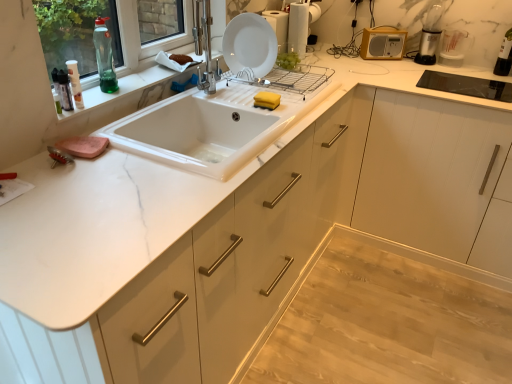
Measure the distance between point (190, 291) and camera.

The distance of point (190, 291) from camera is 1.14 meters.

In the scene shown: Measure the distance between white glossy drawer at center and camera.

The distance of white glossy drawer at center from camera is 33.10 inches.

The image size is (512, 384). Identify the location of light wood floor at lower right. (389, 320).

Describe the element at coordinates (104, 56) in the screenshot. The height and width of the screenshot is (384, 512). I see `green glass bottle at upper left, which is counted as the 2th bottle, starting from the back` at that location.

This screenshot has width=512, height=384. Identify the location of white marble sink at center. (196, 134).

What are the coordinates of `white glossy drawer at center` in the screenshot? It's located at (238, 259).

Considering the points (373, 304) and (367, 49), which point is behind, point (373, 304) or point (367, 49)?

Point (367, 49)

Which of these two, light wood floor at lower right or yellow matte radio at upper right, which is the second appliance in right-to-left order, is smaller?

With smaller size is yellow matte radio at upper right, which is the second appliance in right-to-left order.

Between light wood floor at lower right and yellow matte radio at upper right, which is the second appliance in right-to-left order, which one has larger width?

light wood floor at lower right is wider.

Measure the distance from light wood floor at lower right to yellow matte radio at upper right, which is the second appliance in right-to-left order.

They are 1.33 meters apart.

Is light wood floor at lower right not near marble window sill at upper left?

Yes, light wood floor at lower right is far from marble window sill at upper left.

Is light wood floor at lower right oriented away from marble window sill at upper left?

No.

From the image's perspective, which is below, light wood floor at lower right or marble window sill at upper left?

light wood floor at lower right.

The height and width of the screenshot is (384, 512). There is a light wood floor at lower right. Find the location of `window sill above it (from a real-world perspective)`. window sill above it (from a real-world perspective) is located at coordinates (127, 89).

Identify the location of open that is above the white glossy drawer at center (from a real-world perspective). The height and width of the screenshot is (384, 512). (196, 134).

Is white glossy drawer at center facing towards white marble sink at center?

Yes, white glossy drawer at center faces towards white marble sink at center.

Is white glossy drawer at center positioned behind white marble sink at center?

No, white glossy drawer at center is in front of white marble sink at center.

From a real-world perspective, which object stands above the other?

From a 3D spatial view, white glossy plate at upper center is above.

Considering the sizes of objects white glossy plate at upper center and light wood floor at lower right in the image provided, who is wider, white glossy plate at upper center or light wood floor at lower right?

Wider between the two is light wood floor at lower right.

Between white glossy plate at upper center and light wood floor at lower right, which one is positioned in front?

light wood floor at lower right.

Can you confirm if green glass bottle at upper left, the second bottle when ordered from left to right, is taller than transparent plastic measuring cup at upper right, the 2th appliance in the left-to-right sequence?

Correct, green glass bottle at upper left, the second bottle when ordered from left to right, is much taller as transparent plastic measuring cup at upper right, the 2th appliance in the left-to-right sequence.

Who is more distant, green glass bottle at upper left, the second bottle when ordered from left to right, or transparent plastic measuring cup at upper right, which ranks as the first appliance in right-to-left order?

transparent plastic measuring cup at upper right, which ranks as the first appliance in right-to-left order, is behind.

Could you tell me if green glass bottle at upper left, which is counted as the second bottle, starting from the top, is turned towards transparent plastic measuring cup at upper right, which ranks as the first appliance in right-to-left order?

No, green glass bottle at upper left, which is counted as the second bottle, starting from the top, is not facing towards transparent plastic measuring cup at upper right, which ranks as the first appliance in right-to-left order.

Considering the sizes of green glass bottle at upper left, the second bottle when ordered from left to right, and transparent plastic measuring cup at upper right, the 2th appliance in the left-to-right sequence, in the image, is green glass bottle at upper left, the second bottle when ordered from left to right, wider or thinner than transparent plastic measuring cup at upper right, the 2th appliance in the left-to-right sequence,?

green glass bottle at upper left, the second bottle when ordered from left to right, is thinner than transparent plastic measuring cup at upper right, the 2th appliance in the left-to-right sequence.

Which object is thinner, translucent plastic spray bottle at upper left, the third bottle positioned from the right, or light wood floor at lower right?

With smaller width is translucent plastic spray bottle at upper left, the third bottle positioned from the right.

This screenshot has height=384, width=512. Identify the location of the 1st bottle behind the light wood floor at lower right, starting your count from the anchor. (75, 83).

From the image's perspective, is translucent plastic spray bottle at upper left, marked as the third bottle in a back-to-front arrangement, below light wood floor at lower right?

No.

Is point (72, 88) less distant than point (327, 291)?

Yes, point (72, 88) is closer to viewer.

Does white glossy drawer at center turn towards light wood floor at lower right?

Yes.

Is white glossy drawer at center in front of light wood floor at lower right?

Yes, white glossy drawer at center is closer to the camera.

Considering the sizes of objects white glossy drawer at center and light wood floor at lower right in the image provided, who is bigger, white glossy drawer at center or light wood floor at lower right?

white glossy drawer at center is bigger.

Where is `the 1st appliance to the right of the light wood floor at lower right, starting your count from the anchor`? This screenshot has width=512, height=384. the 1st appliance to the right of the light wood floor at lower right, starting your count from the anchor is located at coordinates (383, 43).

Find the location of `window sill on the left of light wood floor at lower right`. window sill on the left of light wood floor at lower right is located at coordinates (127, 89).

When comparing their distances from translucent plastic spray bottle at upper left, marked as the third bottle in a back-to-front arrangement, does white marble sink at center or yellow matte radio at upper right, which is the second appliance in right-to-left order, seem closer?

white marble sink at center is positioned closer to the anchor translucent plastic spray bottle at upper left, marked as the third bottle in a back-to-front arrangement.

Based on their spatial positions, is white glossy drawer at center or white marble sink at center further from light wood floor at lower right?

Result: white marble sink at center lies further to light wood floor at lower right than the other object.

Based on their spatial positions, is transparent plastic measuring cup at upper right, which ranks as the first appliance in right-to-left order, or white glossy plate at upper center closer to white marble sink at center?

white glossy plate at upper center lies closer to white marble sink at center than the other object.

Which object lies nearer to the anchor point yellow matte radio at upper right, the 1th appliance from the left, marble window sill at upper left or white marble sink at center?

Based on the image, white marble sink at center appears to be nearer to yellow matte radio at upper right, the 1th appliance from the left.

Which object lies nearer to the anchor point green glass bottle at upper left, which is counted as the second bottle, starting from the top, transparent plastic bottle at upper right, which is counted as the 1th bottle, starting from the top, or light wood floor at lower right?

light wood floor at lower right.

In the scene shown: Looking at the image, which one is located further to white glossy drawer at center, transparent plastic measuring cup at upper right, which ranks as the first appliance in right-to-left order, or transparent plastic bottle at upper right, which appears as the 1th bottle when viewed from the back?

transparent plastic bottle at upper right, which appears as the 1th bottle when viewed from the back, is positioned further to the anchor white glossy drawer at center.

Estimate the real-world distances between objects in this image. Which object is closer to white glossy drawer at center, yellow matte radio at upper right, the 1th appliance from the left, or white marble sink at center?

white marble sink at center lies closer to white glossy drawer at center than the other object.

Looking at this image, considering their positions, is green glass bottle at upper left, the second bottle ordered from the bottom, positioned further to transparent plastic bottle at upper right, marked as the third bottle in a bottom-to-top arrangement, than yellow matte radio at upper right, the 1th appliance from the left?

green glass bottle at upper left, the second bottle ordered from the bottom, lies further to transparent plastic bottle at upper right, marked as the third bottle in a bottom-to-top arrangement, than the other object.

Find the location of `appliance between yellow matte radio at upper right, the 1th appliance from the left, and transparent plastic bottle at upper right, which is counted as the 3th bottle, starting from the left`. appliance between yellow matte radio at upper right, the 1th appliance from the left, and transparent plastic bottle at upper right, which is counted as the 3th bottle, starting from the left is located at coordinates (454, 47).

Locate an element on the screen. The height and width of the screenshot is (384, 512). open positioned between white glossy drawer at center and translucent plastic spray bottle at upper left, placed as the 3th bottle when sorted from top to bottom, from near to far is located at coordinates (196, 134).

Where is `window sill situated between translucent plastic spray bottle at upper left, the third bottle positioned from the right, and white glossy plate at upper center from left to right`? window sill situated between translucent plastic spray bottle at upper left, the third bottle positioned from the right, and white glossy plate at upper center from left to right is located at coordinates (127, 89).

Locate an element on the screen. This screenshot has width=512, height=384. appliance located between translucent plastic spray bottle at upper left, placed as the 1th bottle when sorted from left to right, and transparent plastic measuring cup at upper right, the 2th appliance in the left-to-right sequence, in the left-right direction is located at coordinates (383, 43).